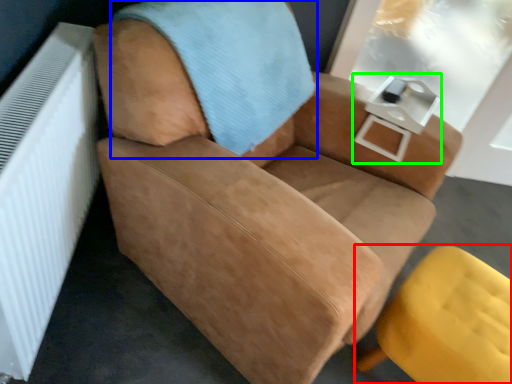
Question: Based on their relative distances, which object is farther from chair (highlighted by a red box)? Choose from blanket (highlighted by a blue box) and table (highlighted by a green box).

Choices:
 (A) blanket
 (B) table

Answer: (A)